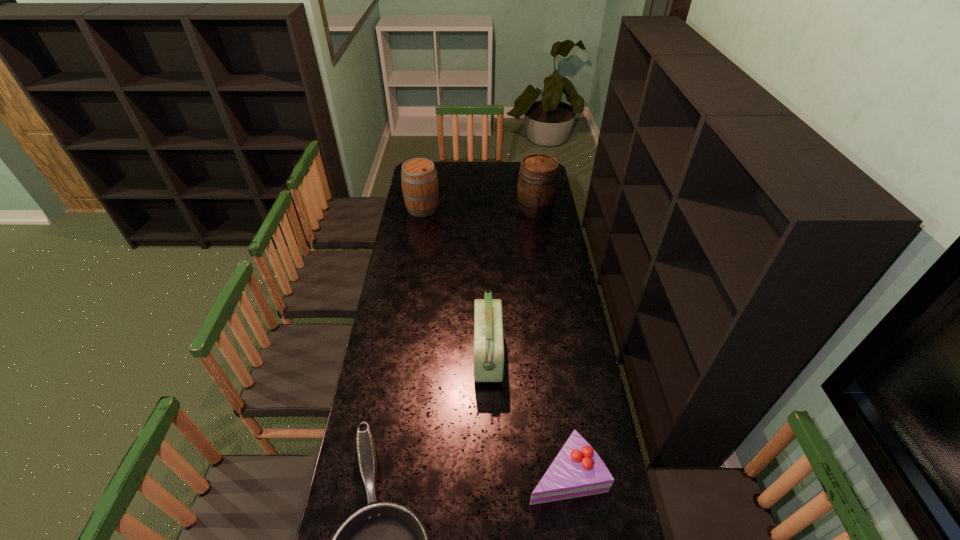
Image resolution: width=960 pixels, height=540 pixels. Identify the location of free space located 0.270m on the back of the cake. (553, 375).

Find the location of a particular element. The width and height of the screenshot is (960, 540). object that is at the left edge is located at coordinates (419, 180).

Image resolution: width=960 pixels, height=540 pixels. Identify the location of cider located in the right edge section of the desktop. (537, 183).

The height and width of the screenshot is (540, 960). I want to click on cake that is at the right edge, so click(577, 470).

In the image, there is a desktop. At what (x,y) coordinates should I click in order to perform the action: click on free region at the left edge. Please return your answer as a coordinate pair (x, y). The width and height of the screenshot is (960, 540). Looking at the image, I should click on (379, 365).

Identify the location of blank space at the right edge of the desktop. pos(564,317).

Where is `free spot between the right cider and the radio receiver`? The width and height of the screenshot is (960, 540). free spot between the right cider and the radio receiver is located at coordinates (512, 282).

Locate an element on the screen. The width and height of the screenshot is (960, 540). empty space that is in between the cake and the right cider is located at coordinates (550, 341).

What are the coordinates of `free spot between the third nearest object and the second shortest object` in the screenshot? It's located at (527, 414).

Where is `vacant space that's between the right cider and the left cider`? This screenshot has height=540, width=960. vacant space that's between the right cider and the left cider is located at coordinates (479, 208).